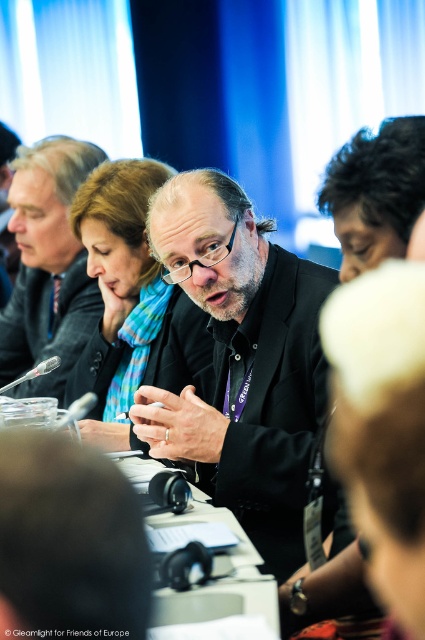
Question: Which of the following is the closest to the observer?

Choices:
 (A) black matte jacket at center
 (B) matte black jacket at center

Answer: (A)

Question: Which is farther from the matte black jacket at center?

Choices:
 (A) white plastic table at center
 (B) black matte jacket at center

Answer: (A)

Question: Based on their relative distances, which object is nearer to the white plastic table at center?

Choices:
 (A) matte black jacket at center
 (B) black matte jacket at center

Answer: (B)

Question: Is the position of black matte jacket at center more distant than that of white plastic table at center?

Choices:
 (A) yes
 (B) no

Answer: (A)

Question: Is the position of black matte jacket at center less distant than that of white plastic table at center?

Choices:
 (A) no
 (B) yes

Answer: (A)

Question: Is black matte jacket at center above white plastic table at center?

Choices:
 (A) yes
 (B) no

Answer: (A)